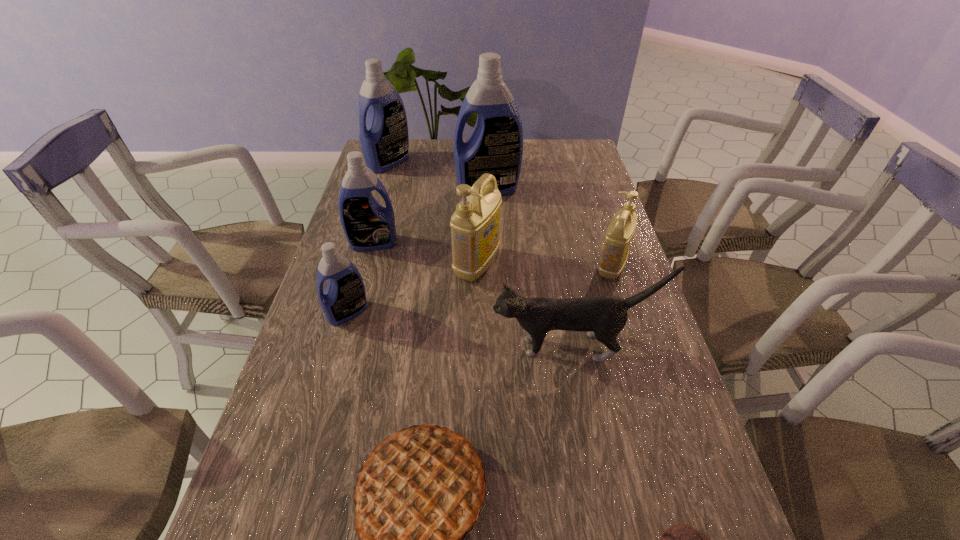
Locate an element on the screen. free space that is in between the third farthest blue detergent and the biggest blue detergent is located at coordinates (430, 216).

What are the coordinates of `free space between the second farthest detergent and the farthest object` in the screenshot? It's located at (438, 176).

You are a GUI agent. You are given a task and a screenshot of the screen. Output one action in this format:
    pyautogui.click(x=<x>, y=<y>)
    Task: Click on the empty space that is in between the tallest detergent and the nearest blue detergent
    This screenshot has width=960, height=540.
    Given the screenshot: What is the action you would take?
    pyautogui.click(x=418, y=251)

Image resolution: width=960 pixels, height=540 pixels. What are the coordinates of `free space between the left beige detergent and the nearest detergent` in the screenshot? It's located at (413, 289).

This screenshot has height=540, width=960. I want to click on free area in between the seventh farthest object and the nearest detergent, so click(460, 329).

Image resolution: width=960 pixels, height=540 pixels. Find the location of `object that is the sixth closest to the seventh farthest object`. object that is the sixth closest to the seventh farthest object is located at coordinates (367, 225).

I want to click on object that stands as the fourth closest to the pie, so click(x=475, y=225).

Select which detergent is the second closest to the bigger beige detergent. Please provide its 2D coordinates. Your answer should be formatted as a tuple, i.e. [(x, y)], where the tuple contains the x and y coordinates of a point satisfying the conditions above.

[(344, 297)]

Where is `detergent that is the third nearest to the eighth nearest object`? detergent that is the third nearest to the eighth nearest object is located at coordinates tap(367, 225).

What are the coordinates of `blue detergent that is the third closest to the second smallest blue detergent` in the screenshot? It's located at (384, 140).